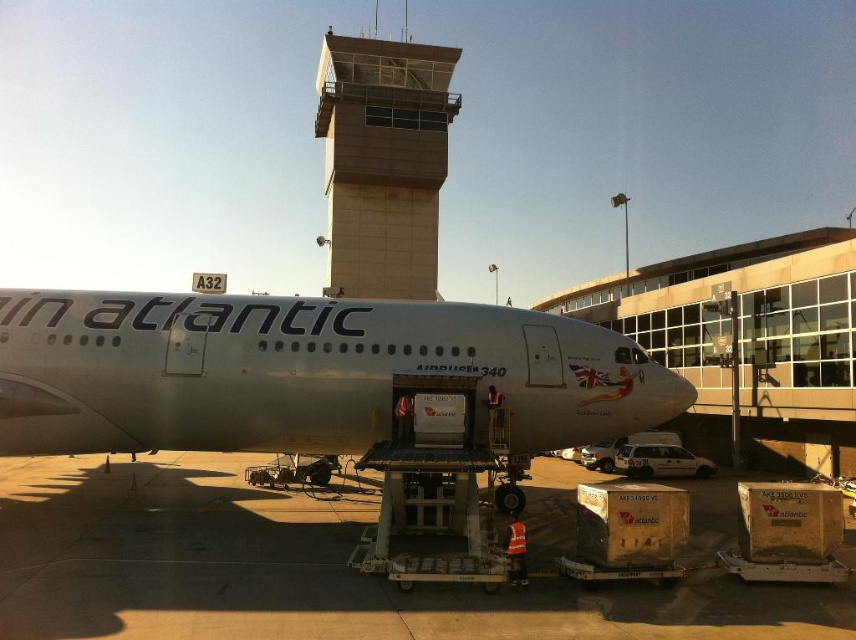
Question: Which of the following is the closest to the observer?

Choices:
 (A) beige concrete control tower at upper center
 (B) white glossy airplane at center

Answer: (B)

Question: Does white glossy airplane at center have a greater width compared to beige concrete control tower at upper center?

Choices:
 (A) yes
 (B) no

Answer: (B)

Question: Is white glossy tarmac at lower center to the left of beige concrete control tower at upper center from the viewer's perspective?

Choices:
 (A) no
 (B) yes

Answer: (A)

Question: Which of the following is the farthest from the observer?

Choices:
 (A) beige concrete control tower at upper center
 (B) white glossy tarmac at lower center

Answer: (A)

Question: Is white glossy airplane at center bigger than beige concrete control tower at upper center?

Choices:
 (A) no
 (B) yes

Answer: (A)

Question: Which point is closer to the camera taking this photo?

Choices:
 (A) (86, 468)
 (B) (355, 381)

Answer: (B)